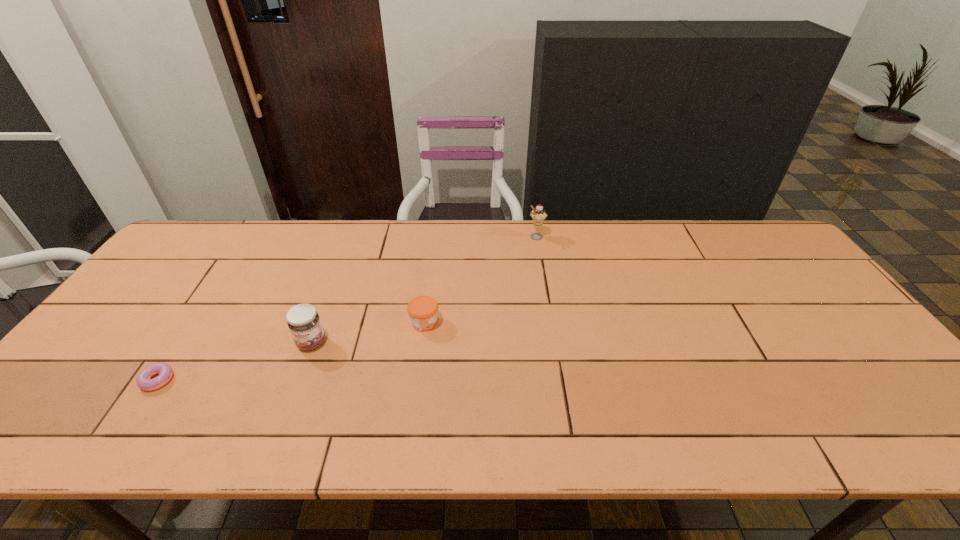
Locate an element on the screen. This screenshot has height=540, width=960. the tallest object is located at coordinates (538, 215).

Where is `the rightmost object`? the rightmost object is located at coordinates (538, 215).

This screenshot has height=540, width=960. I want to click on the second tallest object, so coord(303,321).

At what (x,y) coordinates should I click in order to perform the action: click on the taller jam. Please return your answer as a coordinate pair (x, y). The width and height of the screenshot is (960, 540). Looking at the image, I should click on (303, 321).

Where is `the right jam`? the right jam is located at coordinates (422, 310).

Find the location of a particular element. This screenshot has width=960, height=540. the third object from left to right is located at coordinates (422, 310).

Identify the location of the nearest object. (143, 380).

Where is `doughnut`? The image size is (960, 540). doughnut is located at coordinates coord(143,380).

Identify the location of vacant region located 0.170m on the front of the icecream. (542, 276).

Locate an element on the screen. free location located 0.240m on the front label of the third shortest object is located at coordinates (274, 445).